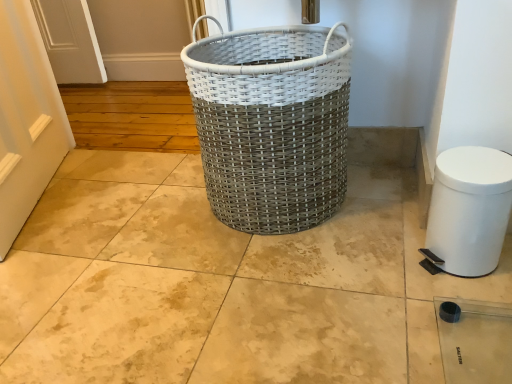
Find the location of a particular element. The image size is (512, 384). vacant space to the left of white woven basket at center is located at coordinates (145, 220).